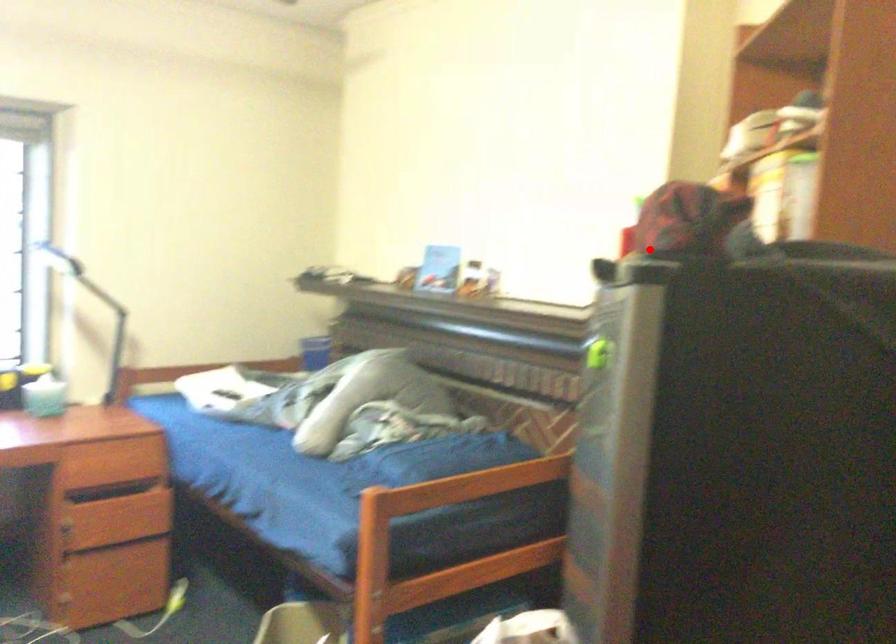
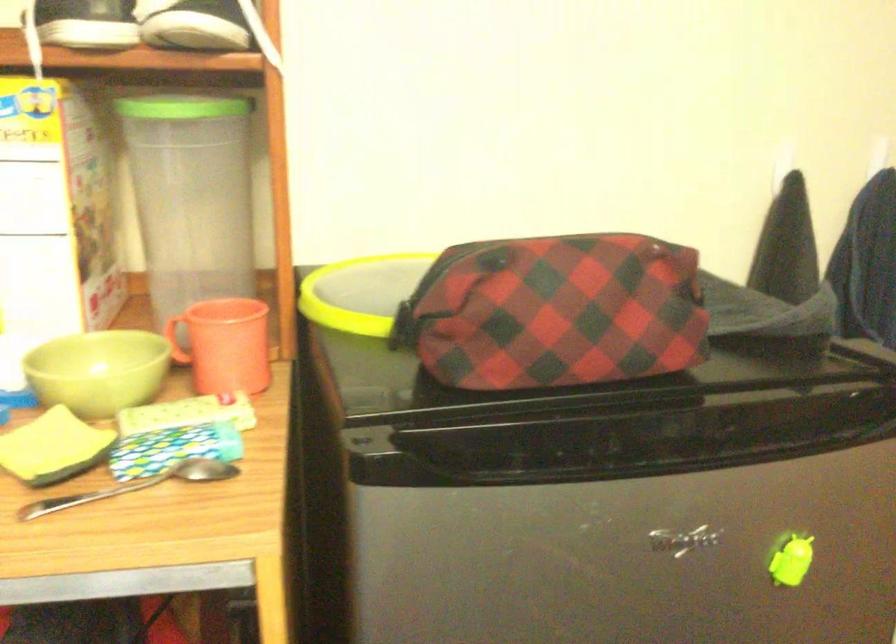
Question: I am providing you with two images of the same scene from different viewpoints. In image1, a red point is highlighted. Considering the same 3D point in image2, which of the following is correct?

Choices:
 (A) It is closer
 (B) It is farther

Answer: (A)